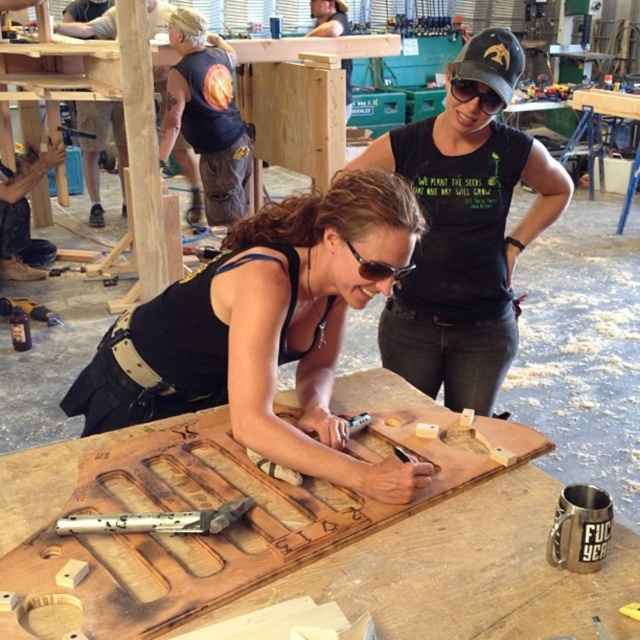
Question: Is black matte tank top at upper center further to the viewer compared to black matte goggles at upper center?

Choices:
 (A) no
 (B) yes

Answer: (A)

Question: Can you confirm if metallic textured hammer at center is smaller than black matte goggles at upper center?

Choices:
 (A) no
 (B) yes

Answer: (A)

Question: Among these objects, which one is nearest to the camera?

Choices:
 (A) wooden workbench at center
 (B) sunglasses at center
 (C) black matte goggles at upper center

Answer: (B)

Question: Which object appears farthest from the camera in this image?

Choices:
 (A) black matte goggles at upper center
 (B) wooden board at center

Answer: (A)

Question: Which object is the closest to the matte black tank top at center?

Choices:
 (A) sunglasses at center
 (B) metallic textured hammer at center
 (C) black matte goggles at upper center

Answer: (A)

Question: Does matte black tank top at center appear on the right side of sunglasses at center?

Choices:
 (A) no
 (B) yes

Answer: (A)